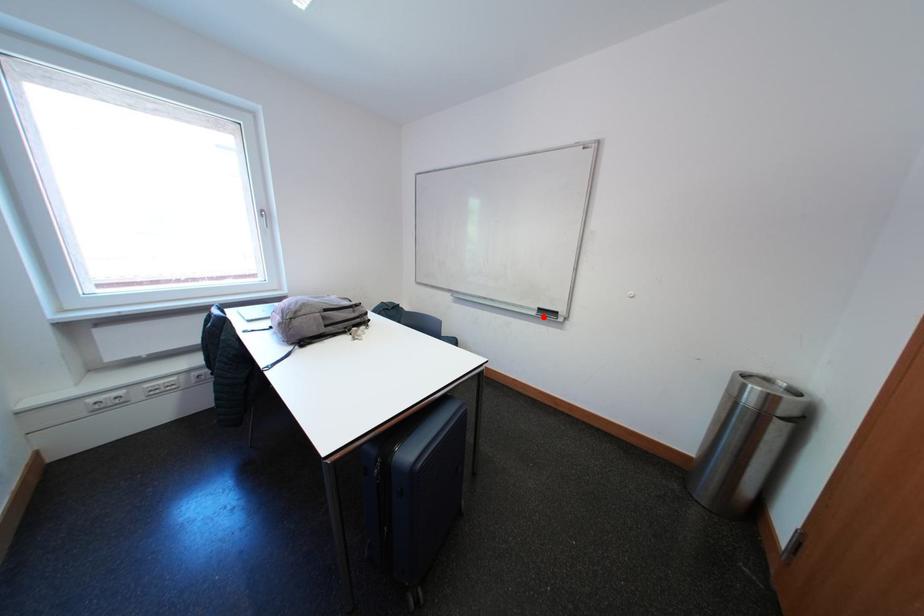
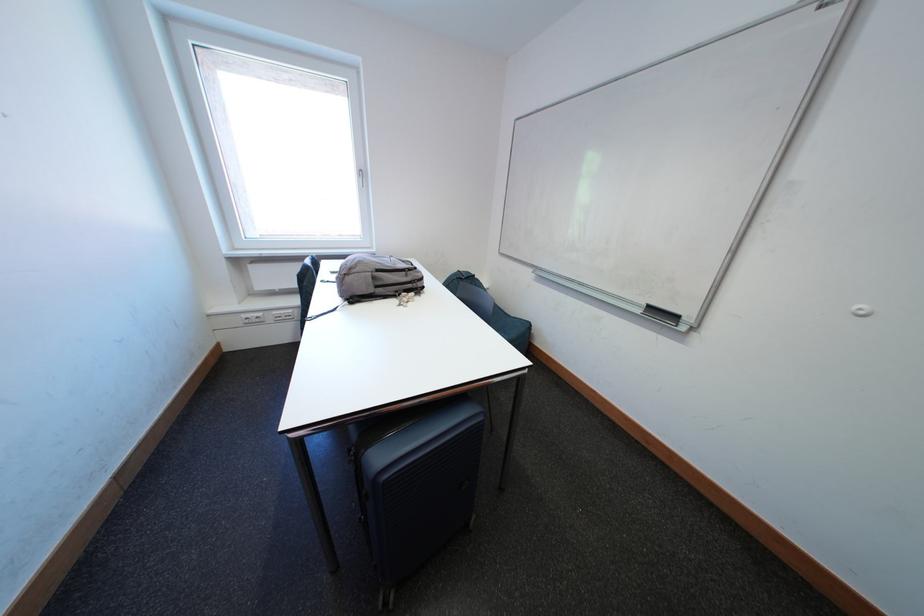
Where in the second image is the point corresponding to the highlighted location from the first image?

(649, 315)